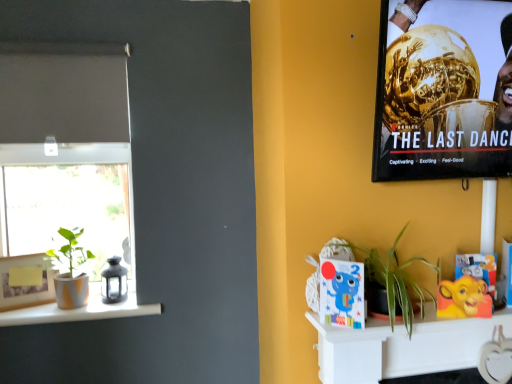
Find the location of a particular element. empty space that is ontop of matte orange vase at left (from a real-world perspective) is located at coordinates (76, 303).